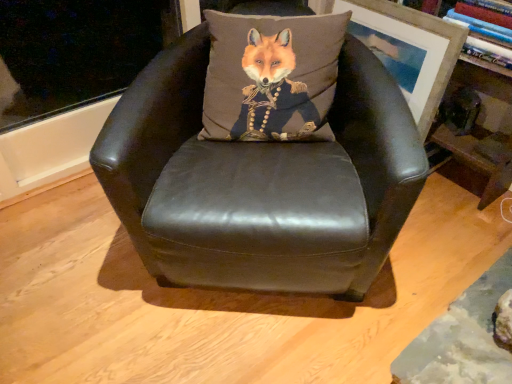
Question: Is wooden bookshelf at upper right touching matte black leather chair at center?

Choices:
 (A) yes
 (B) no

Answer: (B)

Question: From the image's perspective, does wooden bookshelf at upper right appear lower than matte black leather chair at center?

Choices:
 (A) no
 (B) yes

Answer: (A)

Question: From the image's perspective, is wooden bookshelf at upper right on matte black leather chair at center?

Choices:
 (A) yes
 (B) no

Answer: (A)

Question: Can you confirm if wooden bookshelf at upper right is smaller than matte black leather chair at center?

Choices:
 (A) yes
 (B) no

Answer: (A)

Question: Would you say matte black leather chair at center is part of wooden bookshelf at upper right's contents?

Choices:
 (A) yes
 (B) no

Answer: (B)

Question: Is wooden bookshelf at upper right to the right of matte black leather chair at center from the viewer's perspective?

Choices:
 (A) yes
 (B) no

Answer: (A)

Question: Is wooden picture frame at upper right shorter than wooden bookshelf at upper right?

Choices:
 (A) no
 (B) yes

Answer: (B)

Question: From the image's perspective, is wooden picture frame at upper right above wooden bookshelf at upper right?

Choices:
 (A) no
 (B) yes

Answer: (B)

Question: Is wooden picture frame at upper right closer to camera compared to wooden bookshelf at upper right?

Choices:
 (A) yes
 (B) no

Answer: (B)

Question: Is wooden bookshelf at upper right inside wooden picture frame at upper right?

Choices:
 (A) no
 (B) yes

Answer: (A)

Question: From a real-world perspective, is wooden picture frame at upper right beneath wooden bookshelf at upper right?

Choices:
 (A) yes
 (B) no

Answer: (B)

Question: Is wooden picture frame at upper right oriented away from wooden bookshelf at upper right?

Choices:
 (A) yes
 (B) no

Answer: (A)

Question: Can you confirm if wooden picture frame at upper right is taller than matte black leather chair at center?

Choices:
 (A) yes
 (B) no

Answer: (B)